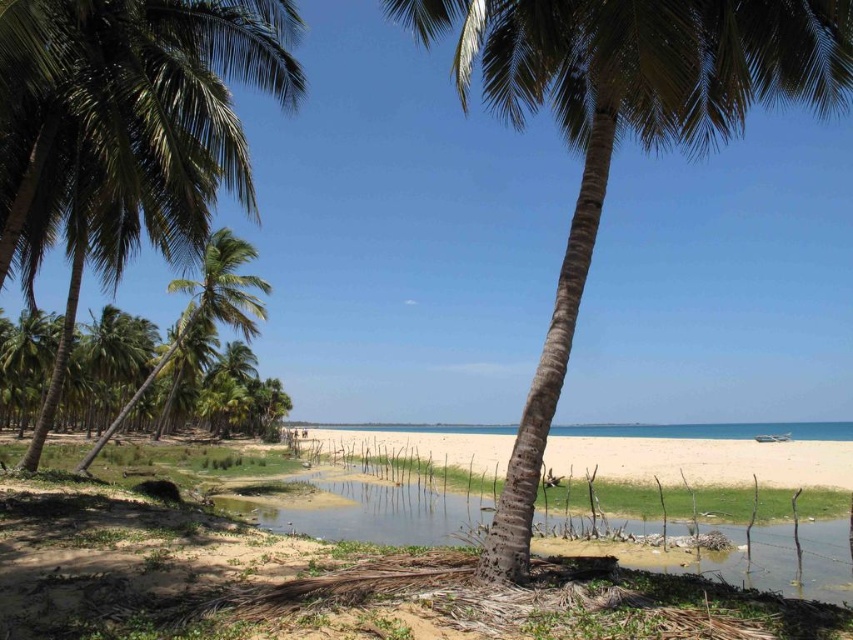
Is green leafy coconut tree at left below white sandy beach at center?

Incorrect, green leafy coconut tree at left is not positioned below white sandy beach at center.

Can you confirm if green leafy coconut tree at left is positioned to the right of white sandy beach at center?

No, green leafy coconut tree at left is not to the right of white sandy beach at center.

Who is more forward, (142, 42) or (366, 432)?

Point (142, 42) is in front.

Where is `green leafy coconut tree at left`? The image size is (853, 640). green leafy coconut tree at left is located at coordinates (128, 122).

Is point (403, 540) closer to viewer compared to point (672, 474)?

Yes, point (403, 540) is in front of point (672, 474).

Who is more forward, (845, 560) or (746, 452)?

Point (845, 560)

Between point (733, 554) and point (689, 476), which one is positioned in front?

Positioned in front is point (733, 554).

Image resolution: width=853 pixels, height=640 pixels. Identify the location of green mossy water at center. (375, 513).

Is the position of green leafy palm tree at center less distant than that of white sandy beach at center?

Yes.

Looking at this image, does green leafy palm tree at center have a larger size compared to white sandy beach at center?

No, green leafy palm tree at center is not bigger than white sandy beach at center.

Is point (521, 10) behind point (325, 442)?

That is False.

Locate an element on the screen. The image size is (853, 640). green leafy palm tree at center is located at coordinates (622, 131).